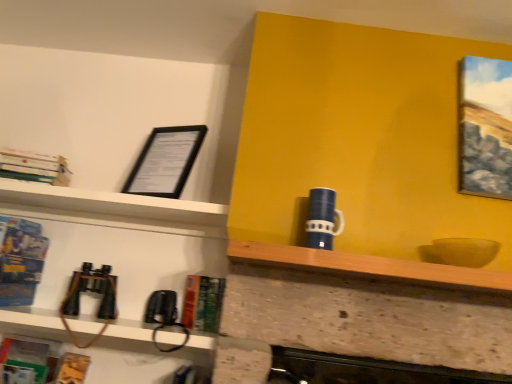
Question: Is hardcover book at center, acting as the 4th book starting from the left, wider than wooden at center?

Choices:
 (A) yes
 (B) no

Answer: (B)

Question: Are hardcover book at center, acting as the 4th book starting from the left, and wooden at center making contact?

Choices:
 (A) yes
 (B) no

Answer: (B)

Question: Is hardcover book at center, arranged as the 3th book when viewed from the top, facing away from wooden at center?

Choices:
 (A) yes
 (B) no

Answer: (B)

Question: Can you confirm if hardcover book at center, arranged as the 3th book when viewed from the top, is bigger than wooden at center?

Choices:
 (A) yes
 (B) no

Answer: (B)

Question: Does hardcover book at center, which is counted as the first book, starting from the right, appear on the left side of wooden at center?

Choices:
 (A) no
 (B) yes

Answer: (B)

Question: From a real-world perspective, is blue glossy mug at upper center above or below blue glossy book at left, which ranks as the first book in left-to-right order?

Choices:
 (A) below
 (B) above

Answer: (B)

Question: Relative to blue glossy book at left, which is the second book in top-to-bottom order, is blue glossy mug at upper center in front or behind?

Choices:
 (A) front
 (B) behind

Answer: (A)

Question: Considering the positions of point (340, 213) and point (16, 236), is point (340, 213) closer or farther from the camera than point (16, 236)?

Choices:
 (A) closer
 (B) farther

Answer: (A)

Question: From the image's perspective, is blue glossy mug at upper center positioned above or below blue glossy book at left, the fourth book in the right-to-left sequence?

Choices:
 (A) below
 (B) above

Answer: (B)

Question: Considering their positions, is hardcover books at upper left, positioned as the second book in right-to-left order, located in front of or behind blue glossy mug at upper center?

Choices:
 (A) front
 (B) behind

Answer: (B)

Question: From a real-world perspective, is hardcover books at upper left, which is the 3th book in left-to-right order, physically located above or below blue glossy mug at upper center?

Choices:
 (A) above
 (B) below

Answer: (A)

Question: In terms of size, does hardcover books at upper left, which ranks as the first book in top-to-bottom order, appear bigger or smaller than blue glossy mug at upper center?

Choices:
 (A) small
 (B) big

Answer: (B)

Question: Would you say hardcover books at upper left, positioned as the second book in right-to-left order, is to the left or to the right of blue glossy mug at upper center in the picture?

Choices:
 (A) left
 (B) right

Answer: (A)

Question: Visually, is hardcover book at center, acting as the 4th book starting from the left, positioned to the left or to the right of blue glossy book at left, which appears as the 3th book when ordered from the bottom?

Choices:
 (A) right
 (B) left

Answer: (A)

Question: Relative to blue glossy book at left, which ranks as the first book in left-to-right order, is hardcover book at center, which is counted as the first book, starting from the right, in front or behind?

Choices:
 (A) front
 (B) behind

Answer: (B)